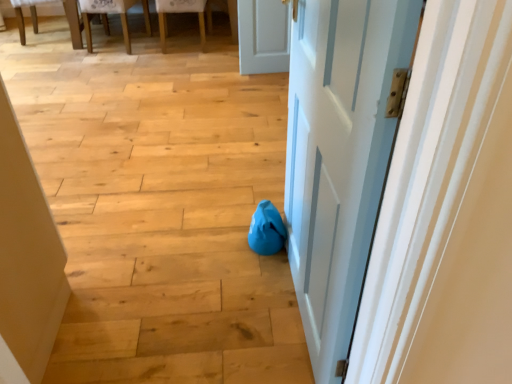
Find the location of `free space to the back side of blue fabric bean bag at center`. free space to the back side of blue fabric bean bag at center is located at coordinates (244, 205).